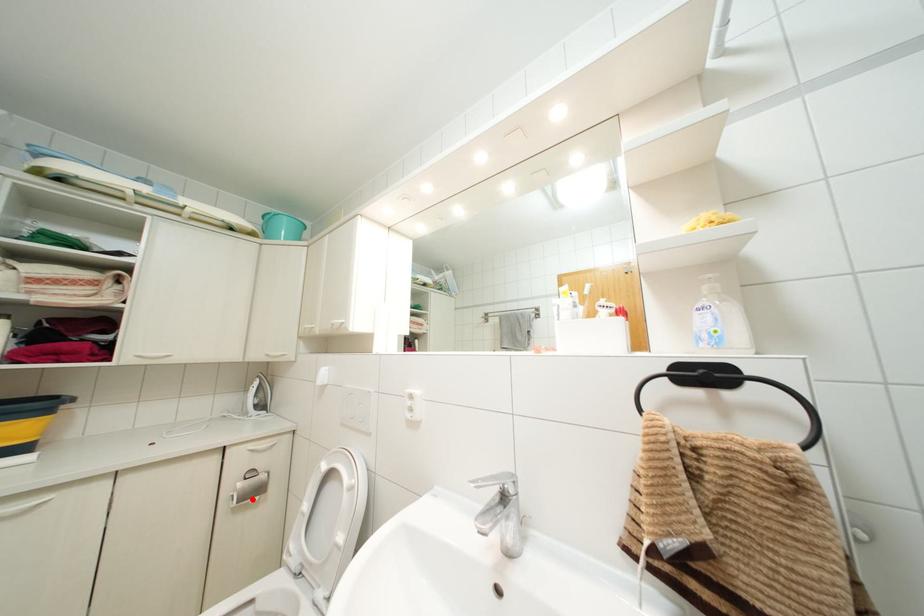
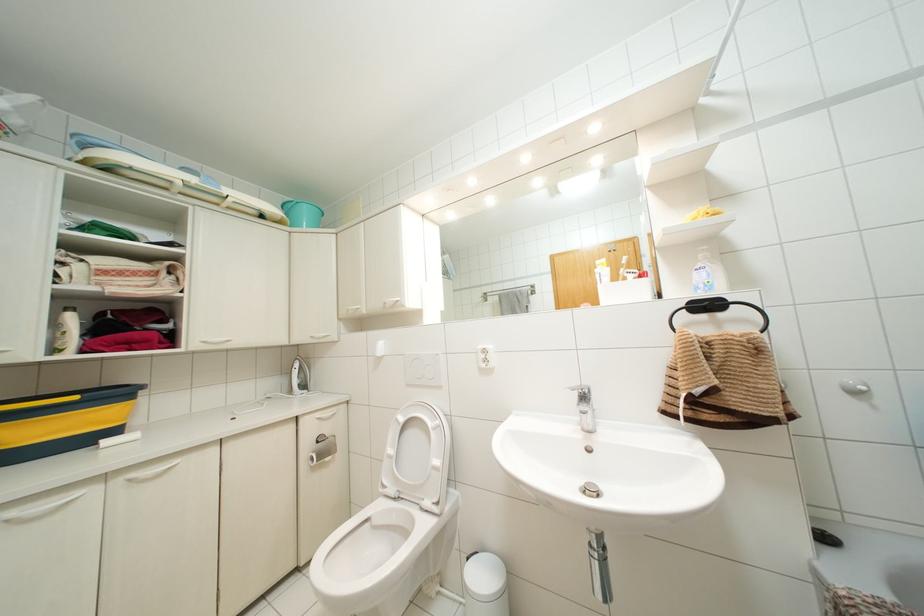
The point at the highlighted location is marked in the first image. Where is the corresponding point in the second image?

(326, 459)